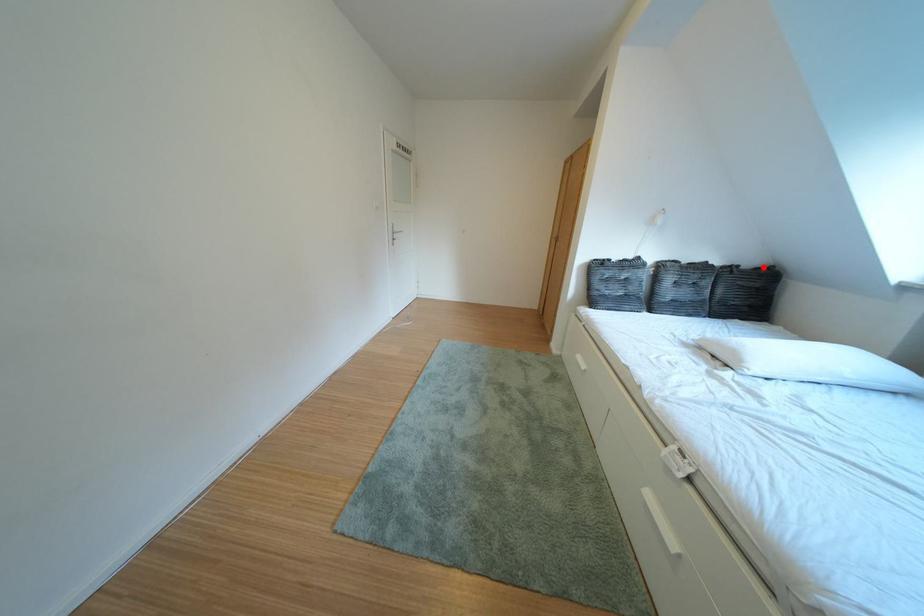
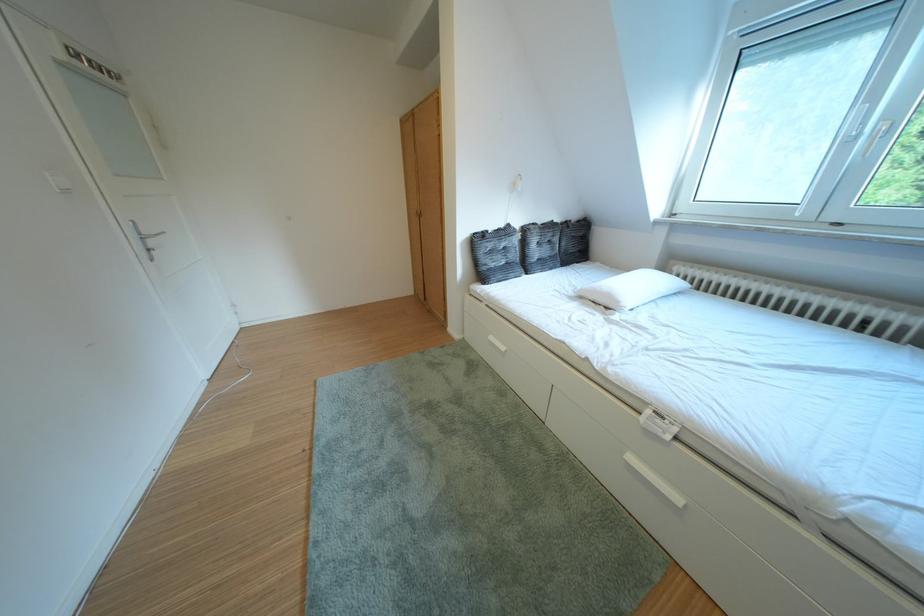
Question: I am providing you with two images of the same scene from different viewpoints. A red point is marked on the first image. At the location where the point appears in image 1, is it still visible in image 2?

Choices:
 (A) Yes
 (B) No

Answer: (A)